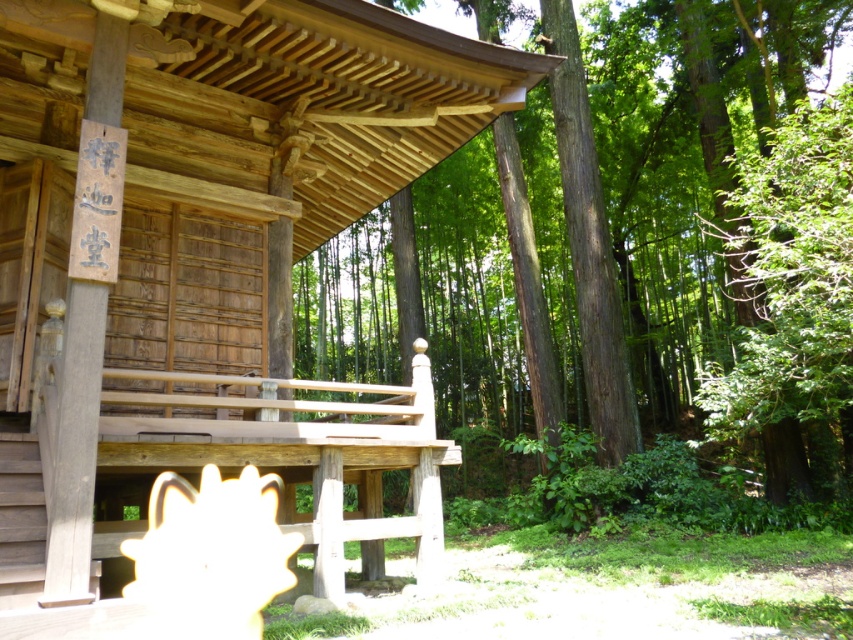
Does wooden cabin at center have a larger size compared to smooth brown tree trunk at center?

Actually, wooden cabin at center might be smaller than smooth brown tree trunk at center.

Is point (61, 301) in front of point (555, 157)?

Yes.

Is point (213, 35) farther from viewer compared to point (706, 205)?

No, it is in front of (706, 205).

The width and height of the screenshot is (853, 640). Identify the location of wooden cabin at center. (207, 260).